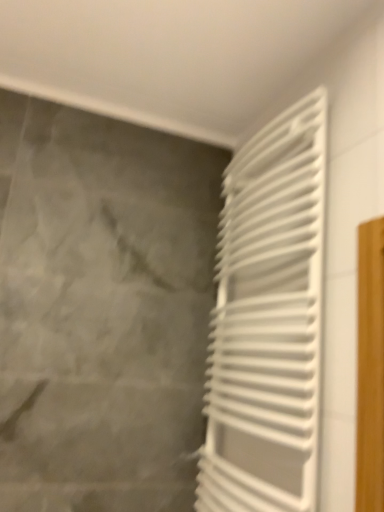
What is the approximate height of white matte radiator at right?

1.25 meters.

The width and height of the screenshot is (384, 512). What are the coordinates of `white matte radiator at right` in the screenshot? It's located at pos(267,321).

This screenshot has height=512, width=384. Describe the element at coordinates (267, 321) in the screenshot. I see `white matte radiator at right` at that location.

From the picture: What is the approximate width of white matte radiator at right?

white matte radiator at right is 5.40 inches in width.

In order to click on white matte radiator at right in this screenshot , I will do `click(267, 321)`.